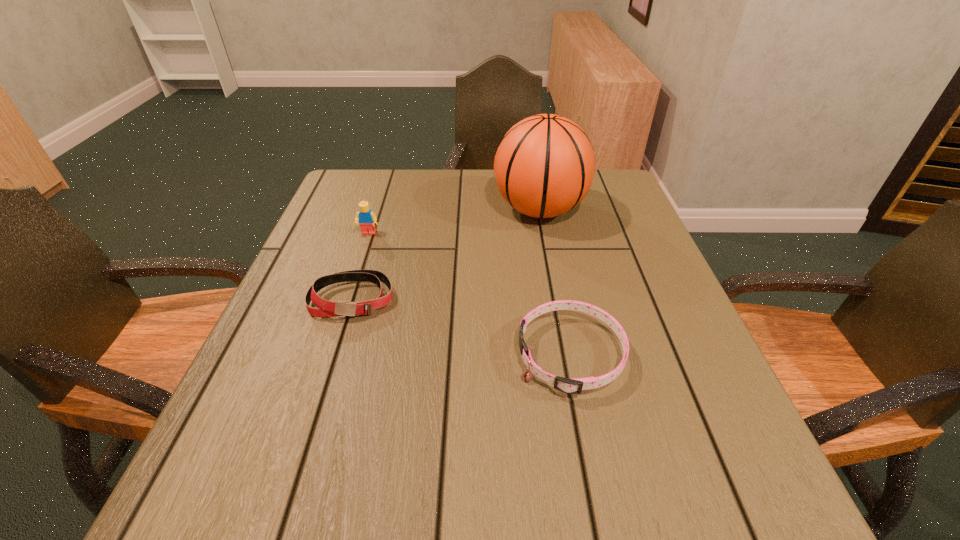
Identify the location of vacant area that lies between the basketball and the left dog collar. (446, 254).

At what (x,y) coordinates should I click in order to perform the action: click on object that is the closest to the basketball. Please return your answer as a coordinate pair (x, y). The width and height of the screenshot is (960, 540). Looking at the image, I should click on (325, 308).

The height and width of the screenshot is (540, 960). I want to click on object that is the second nearest to the basketball, so click(x=575, y=385).

This screenshot has width=960, height=540. I want to click on free space that satisfies the following two spatial constraints: 1. on the front-facing side of the Lego; 2. on the left side of the left dog collar, so click(348, 299).

Locate an element on the screen. vacant region that satisfies the following two spatial constraints: 1. on the front-facing side of the left dog collar; 2. on the left side of the Lego is located at coordinates (348, 299).